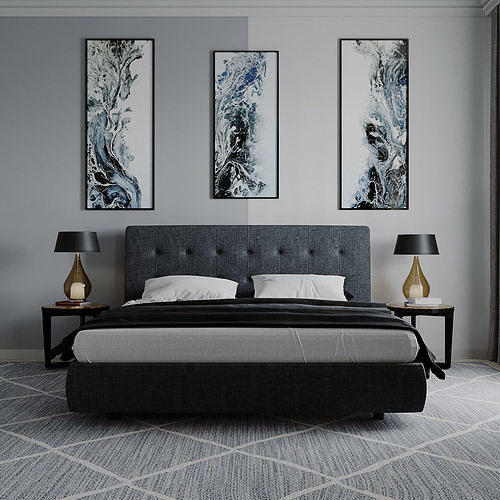
Locate an element on the screen. The height and width of the screenshot is (500, 500). bed is located at coordinates [237, 386].